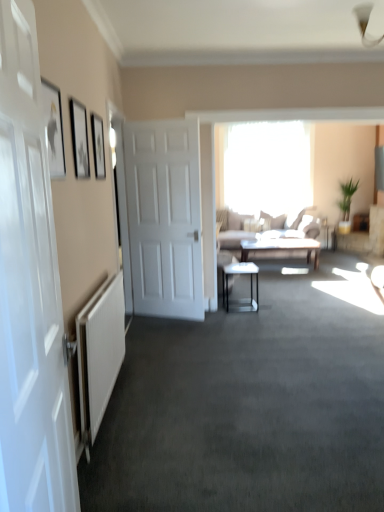
What is the approximate width of white textured radiator at lower left?

4.41 inches.

Consider the image. What is the approximate height of white matte door at center, the second door positioned from the front?

white matte door at center, the second door positioned from the front, is 6.57 feet in height.

Identify the location of matte black picture frame at upper left, which appears as the 2th picture frame when viewed from the front. This screenshot has width=384, height=512. (79, 138).

What do you see at coordinates (79, 138) in the screenshot?
I see `matte black picture frame at upper left, which appears as the 2th picture frame when viewed from the front` at bounding box center [79, 138].

The height and width of the screenshot is (512, 384). Identify the location of white glossy door at left, the first door from the front. (30, 290).

What do you see at coordinates (98, 145) in the screenshot? I see `matte black picture frame at upper left, the 3th picture frame positioned from the front` at bounding box center [98, 145].

Locate an element on the screen. This screenshot has width=384, height=512. matte black picture frame at upper left, the third picture frame viewed from the back is located at coordinates (54, 128).

In order to click on white textured radiator at lower left in this screenshot , I will do `click(99, 354)`.

Is metallic glass table at center, which appears as the 1th table when viewed from the left, positioned with its back to white textured radiator at lower left?

No, metallic glass table at center, which appears as the 1th table when viewed from the left, is not facing the opposite direction of white textured radiator at lower left.

Based on the photo, can white textured radiator at lower left be found inside metallic glass table at center, the second table in the top-to-bottom sequence?

That's incorrect, white textured radiator at lower left is not inside metallic glass table at center, the second table in the top-to-bottom sequence.

From the image's perspective, is metallic glass table at center, which appears as the 1th table when viewed from the left, located beneath white textured radiator at lower left?

No, from the image's perspective, metallic glass table at center, which appears as the 1th table when viewed from the left, is not below white textured radiator at lower left.

Relative to white textured radiator at lower left, is metallic glass table at center, positioned as the 1th table in front-to-back order, in front or behind?

metallic glass table at center, positioned as the 1th table in front-to-back order, is behind white textured radiator at lower left.

From a real-world perspective, is light brown fabric couch at center over white textured radiator at lower left?

Yes, from a real-world perspective, light brown fabric couch at center is on top of white textured radiator at lower left.

Are light brown fabric couch at center and white textured radiator at lower left located far from each other?

Indeed, light brown fabric couch at center is not near white textured radiator at lower left.

From the image's perspective, does light brown fabric couch at center appear lower than white textured radiator at lower left?

Actually, light brown fabric couch at center appears above white textured radiator at lower left in the image.

Is light brown fabric couch at center in front of white textured radiator at lower left?

That is False.

From the image's perspective, is matte gray table at center, marked as the first table in a right-to-left arrangement, below matte black picture frame at upper left, the first picture frame from the back?

Yes, from the image's perspective, matte gray table at center, marked as the first table in a right-to-left arrangement, is below matte black picture frame at upper left, the first picture frame from the back.

Is point (247, 247) farther from viewer compared to point (97, 148)?

Yes.

How different are the orientations of matte gray table at center, the 2th table when ordered from front to back, and matte black picture frame at upper left, the first picture frame from the back, in degrees?

There is a 92.6-degree angle between the facing directions of matte gray table at center, the 2th table when ordered from front to back, and matte black picture frame at upper left, the first picture frame from the back.

Is matte black picture frame at upper left, the 3th picture frame positioned from the front, completely or partially inside matte gray table at center, marked as the 1th table in a back-to-front arrangement?

No, matte black picture frame at upper left, the 3th picture frame positioned from the front, is located outside of matte gray table at center, marked as the 1th table in a back-to-front arrangement.

Can you confirm if matte gray table at center, the 2th table when ordered from front to back, is positioned to the left of transparent glass window at center?

Indeed, matte gray table at center, the 2th table when ordered from front to back, is positioned on the left side of transparent glass window at center.

Which is farther from the camera, [255,249] or [245,166]?

Positioned behind is point [245,166].

What's the angular difference between matte gray table at center, the second table positioned from the left, and transparent glass window at center's facing directions?

They differ by 2.07 degrees in their facing directions.

Consider the image. Measure the distance between matte gray table at center, the second table positioned from the left, and transparent glass window at center.

matte gray table at center, the second table positioned from the left, and transparent glass window at center are 5.73 feet apart.

Considering the sizes of objects light brown fabric couch at center and transparent glass window at center in the image provided, who is shorter, light brown fabric couch at center or transparent glass window at center?

light brown fabric couch at center.

Which is behind, light brown fabric couch at center or transparent glass window at center?

Positioned behind is transparent glass window at center.

Is light brown fabric couch at center bigger than transparent glass window at center?

Yes.

Is light brown fabric couch at center placed right next to transparent glass window at center?

No.

Between white textured radiator at lower left and matte black picture frame at upper left, the first picture frame from the back, which one appears on the right side from the viewer's perspective?

Positioned to the right is white textured radiator at lower left.

Based on the photo, how much distance is there between white textured radiator at lower left and matte black picture frame at upper left, the first picture frame from the back?

white textured radiator at lower left and matte black picture frame at upper left, the first picture frame from the back, are 1.12 meters apart.

From the image's perspective, which one is positioned lower, white textured radiator at lower left or matte black picture frame at upper left, the 3th picture frame positioned from the front?

white textured radiator at lower left is shown below in the image.

Which of these two, metallic glass table at center, the second table in the right-to-left sequence, or white matte door at center, which appears as the first door when viewed from the back, stands shorter?

With less height is metallic glass table at center, the second table in the right-to-left sequence.

Which object is more forward, metallic glass table at center, which appears as the first table when ordered from the bottom, or white matte door at center, the second door positioned from the front?

Positioned in front is white matte door at center, the second door positioned from the front.

From a real-world perspective, is metallic glass table at center, which appears as the first table when ordered from the bottom, positioned above or below white matte door at center, the second door positioned from the front?

metallic glass table at center, which appears as the first table when ordered from the bottom, is below white matte door at center, the second door positioned from the front.

Is white matte door at center, which appears as the first door when viewed from the back, at the back of metallic glass table at center, which appears as the 1th table when viewed from the left?

Yes, metallic glass table at center, which appears as the 1th table when viewed from the left, is positioned with its back facing white matte door at center, which appears as the first door when viewed from the back.

Identify the location of radiator in front of the metallic glass table at center, which appears as the first table when ordered from the bottom. (99, 354).

Locate an element on the screen. The height and width of the screenshot is (512, 384). radiator on the left side of light brown fabric couch at center is located at coordinates (x=99, y=354).

Looking at the image, which one is located closer to light brown fabric couch at center, matte black picture frame at upper left, which is the second picture frame in back-to-front order, or white textured radiator at lower left?

white textured radiator at lower left.

From the image, which object appears to be farther from white matte door at center, which appears as the first door when viewed from the back, white textured radiator at lower left or metallic glass table at center, which appears as the first table when ordered from the bottom?

white textured radiator at lower left.

When comparing their distances from matte black picture frame at upper left, which ranks as the 1th picture frame in front-to-back order, does matte black picture frame at upper left, the first picture frame from the back, or white matte door at center, which appears as the first door when viewed from the back, seem further?

Based on the image, white matte door at center, which appears as the first door when viewed from the back, appears to be further to matte black picture frame at upper left, which ranks as the 1th picture frame in front-to-back order.

Estimate the real-world distances between objects in this image. Which object is closer to white textured radiator at lower left, matte black picture frame at upper left, the third picture frame viewed from the back, or matte gray table at center, the second table positioned from the left?

matte black picture frame at upper left, the third picture frame viewed from the back, is positioned closer to the anchor white textured radiator at lower left.

Which object lies nearer to the anchor point matte gray table at center, which is the 1th table in top-to-bottom order, light brown fabric couch at center or matte black picture frame at upper left, the first picture frame from the back?

Based on the image, light brown fabric couch at center appears to be nearer to matte gray table at center, which is the 1th table in top-to-bottom order.

When comparing their distances from white glossy door at left, the first door from the front, does matte gray table at center, the 2th table when ordered from front to back, or transparent glass window at center seem further?

Based on the image, transparent glass window at center appears to be further to white glossy door at left, the first door from the front.

Considering their positions, is transparent glass window at center positioned further to matte black picture frame at upper left, the 3th picture frame positioned from the front, than metallic glass table at center, which appears as the first table when ordered from the bottom?

transparent glass window at center is positioned further to the anchor matte black picture frame at upper left, the 3th picture frame positioned from the front.

From the image, which object appears to be farther from white textured radiator at lower left, white glossy door at left, placed as the second door when sorted from back to front, or matte gray table at center, which is the 1th table in top-to-bottom order?

matte gray table at center, which is the 1th table in top-to-bottom order.

Where is `door between white textured radiator at lower left and transparent glass window at center in the front-back direction`? door between white textured radiator at lower left and transparent glass window at center in the front-back direction is located at coordinates (163, 219).

Where is `door located between white textured radiator at lower left and light brown fabric couch at center in the depth direction`? The width and height of the screenshot is (384, 512). door located between white textured radiator at lower left and light brown fabric couch at center in the depth direction is located at coordinates (163, 219).

Find the location of a particular element. This screenshot has width=384, height=512. door between white glossy door at left, the first door from the front, and transparent glass window at center, along the z-axis is located at coordinates (163, 219).

Locate an element on the screen. table positioned between white glossy door at left, placed as the second door when sorted from back to front, and matte gray table at center, which is the 1th table in top-to-bottom order, from near to far is located at coordinates (250, 287).